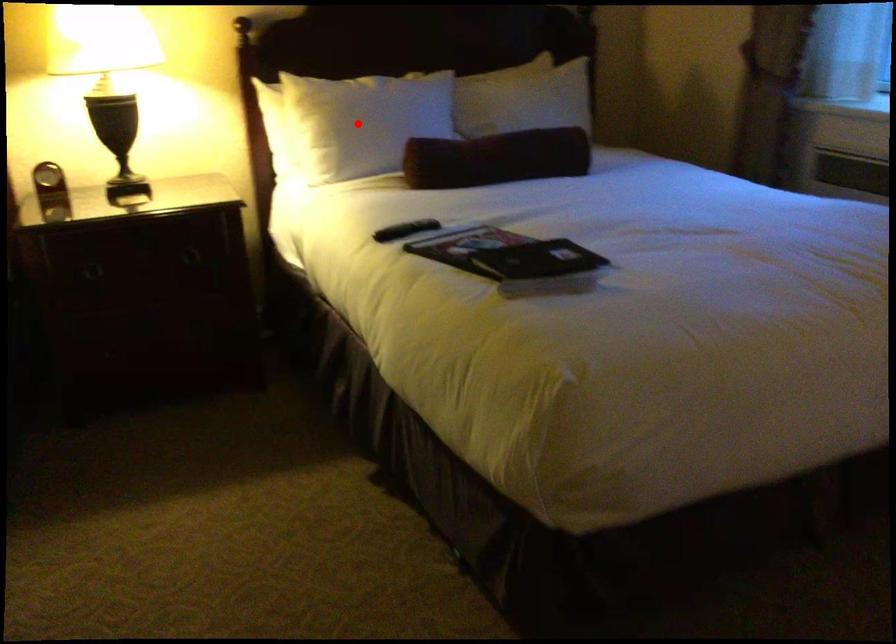
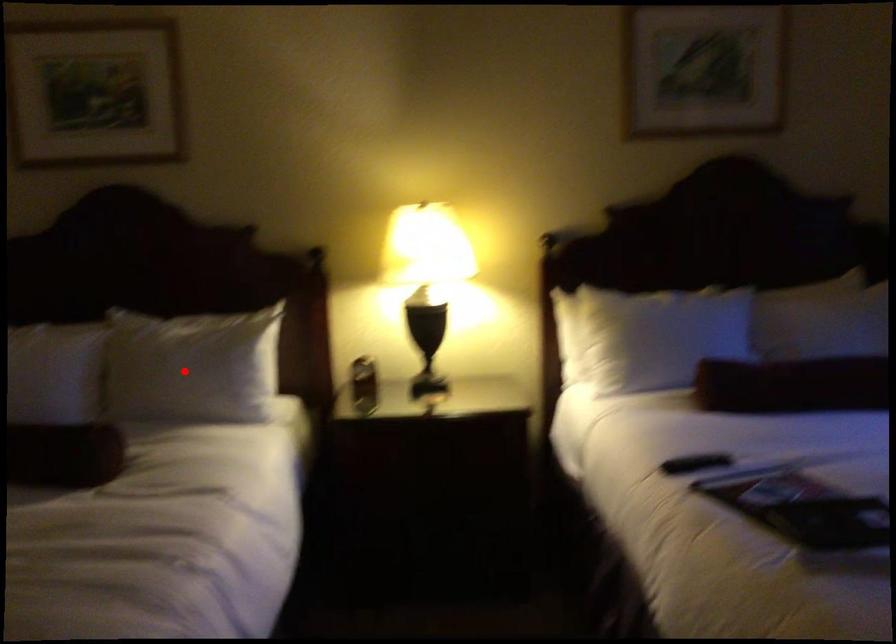
I am providing you with two images of the same scene from different viewpoints. A red point is marked on the first image and another point is marked on the second image. Are the points marked in image1 and image2 representing the same 3D position?

No